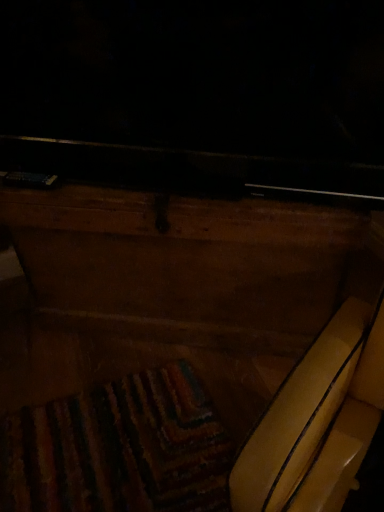
Where is `yellow leather swivel chair at center`? yellow leather swivel chair at center is located at coordinates (317, 420).

Describe the element at coordinates (317, 420) in the screenshot. Image resolution: width=384 pixels, height=512 pixels. I see `yellow leather swivel chair at center` at that location.

This screenshot has height=512, width=384. What are the coordinates of `wooden chest at center` in the screenshot? It's located at (174, 289).

Describe the element at coordinates (174, 289) in the screenshot. I see `wooden chest at center` at that location.

What are the coordinates of `yellow leather swivel chair at center` in the screenshot? It's located at (317, 420).

Looking at this image, which object is positioned more to the left, yellow leather swivel chair at center or wooden chest at center?

wooden chest at center.

Which is behind, yellow leather swivel chair at center or wooden chest at center?

wooden chest at center is more distant.

Which is in front, point (343, 481) or point (240, 247)?

Point (343, 481)

From the image's perspective, is yellow leather swivel chair at center above wooden chest at center?

Incorrect, from the image's perspective, yellow leather swivel chair at center is lower than wooden chest at center.

From a real-world perspective, which object rests below the other?

wooden chest at center is physically lower.

In the scene shown: Which object is thinner, yellow leather swivel chair at center or wooden chest at center?

Thinner between the two is yellow leather swivel chair at center.

Based on the photo, considering the sizes of objects yellow leather swivel chair at center and wooden chest at center in the image provided, who is shorter, yellow leather swivel chair at center or wooden chest at center?

wooden chest at center is shorter.

Is yellow leather swivel chair at center smaller than wooden chest at center?

Incorrect, yellow leather swivel chair at center is not smaller in size than wooden chest at center.

Is wooden chest at center located within yellow leather swivel chair at center?

No, wooden chest at center is not inside yellow leather swivel chair at center.

Are yellow leather swivel chair at center and wooden chest at center making contact?

yellow leather swivel chair at center and wooden chest at center are not in contact.

Does yellow leather swivel chair at center turn towards wooden chest at center?

No, yellow leather swivel chair at center is not oriented towards wooden chest at center.

What's the angular difference between yellow leather swivel chair at center and wooden chest at center's facing directions?

147 degrees separate the facing orientations of yellow leather swivel chair at center and wooden chest at center.

Based on the photo, measure the distance between yellow leather swivel chair at center and wooden chest at center.

They are 16.39 inches apart.

This screenshot has height=512, width=384. In order to click on swivel chair positioned vertically above the wooden chest at center (from a real-world perspective) in this screenshot , I will do `click(317, 420)`.

Considering the positions of objects wooden chest at center and yellow leather swivel chair at center in the image provided, who is more to the right, wooden chest at center or yellow leather swivel chair at center?

From the viewer's perspective, yellow leather swivel chair at center appears more on the right side.

Considering their positions, is wooden chest at center located in front of or behind yellow leather swivel chair at center?

In the image, wooden chest at center appears behind yellow leather swivel chair at center.

Does point (275, 291) come farther from viewer compared to point (330, 385)?

Yes, point (275, 291) is behind point (330, 385).

From the image's perspective, is wooden chest at center located beneath yellow leather swivel chair at center?

No, from the image's perspective, wooden chest at center is not beneath yellow leather swivel chair at center.

From a real-world perspective, is wooden chest at center over yellow leather swivel chair at center?

Incorrect, from a real-world perspective, wooden chest at center is lower than yellow leather swivel chair at center.

Looking at this image, can you confirm if wooden chest at center is thinner than yellow leather swivel chair at center?

No.

Is wooden chest at center taller or shorter than yellow leather swivel chair at center?

Clearly, wooden chest at center is shorter compared to yellow leather swivel chair at center.

In terms of size, does wooden chest at center appear bigger or smaller than yellow leather swivel chair at center?

Considering their sizes, wooden chest at center takes up less space than yellow leather swivel chair at center.

Is yellow leather swivel chair at center located within wooden chest at center?

No.

Is wooden chest at center not close to yellow leather swivel chair at center?

No, wooden chest at center is in close proximity to yellow leather swivel chair at center.

Is wooden chest at center facing towards yellow leather swivel chair at center?

No, wooden chest at center is not oriented towards yellow leather swivel chair at center.

The image size is (384, 512). In order to click on furniture below the yellow leather swivel chair at center (from a real-world perspective) in this screenshot , I will do `click(174, 289)`.

Locate an element on the screen. furniture located above the yellow leather swivel chair at center (from the image's perspective) is located at coordinates (174, 289).

You are a GUI agent. You are given a task and a screenshot of the screen. Output one action in this format:
    pyautogui.click(x=<x>, y=<y>)
    Task: Click on the furniture on the left of yellow leather swivel chair at center
    The height and width of the screenshot is (512, 384).
    Given the screenshot: What is the action you would take?
    pyautogui.click(x=174, y=289)